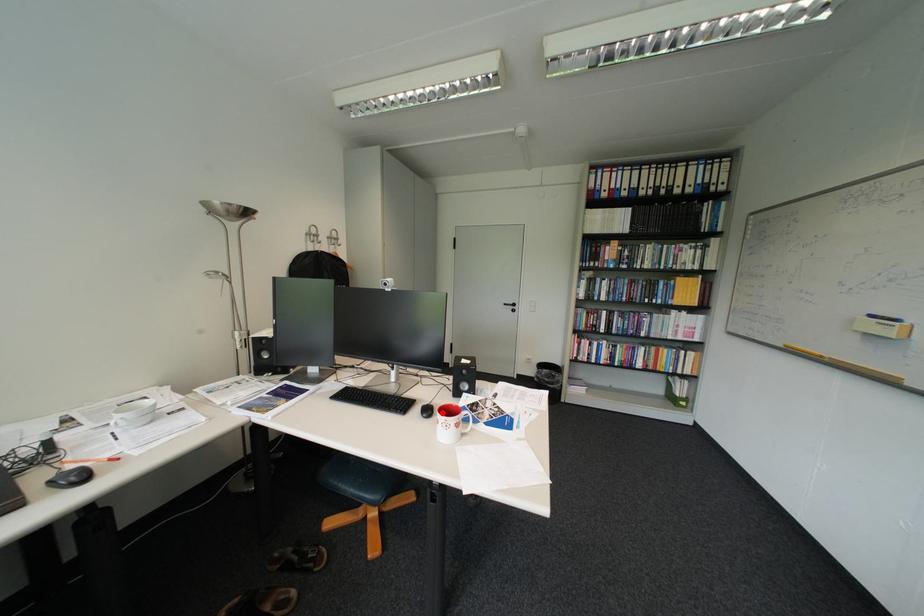
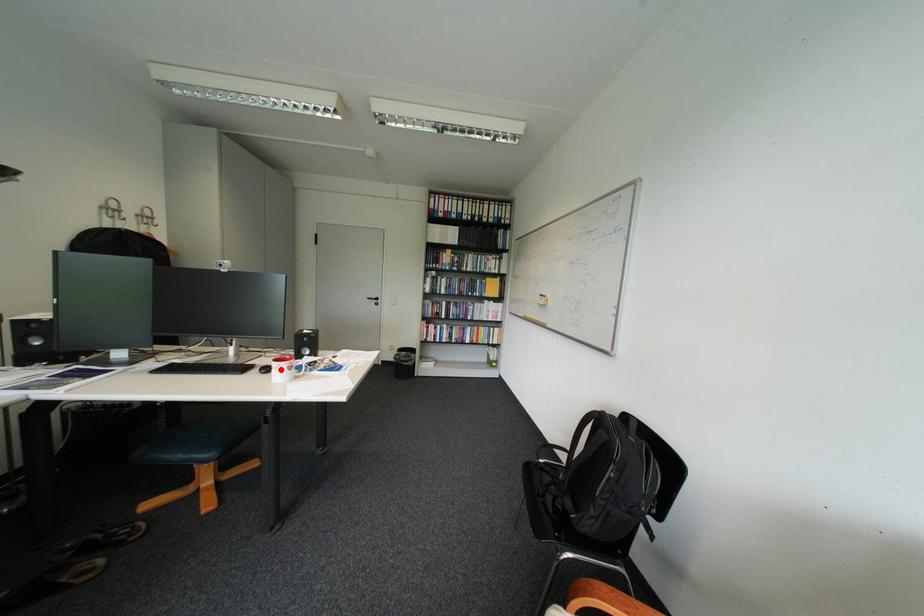
I am providing you with two images of the same scene from different viewpoints. A red point is marked on the first image and another point is marked on the second image. Does the point marked in image1 correspond to the same location as the one in image2?

Yes